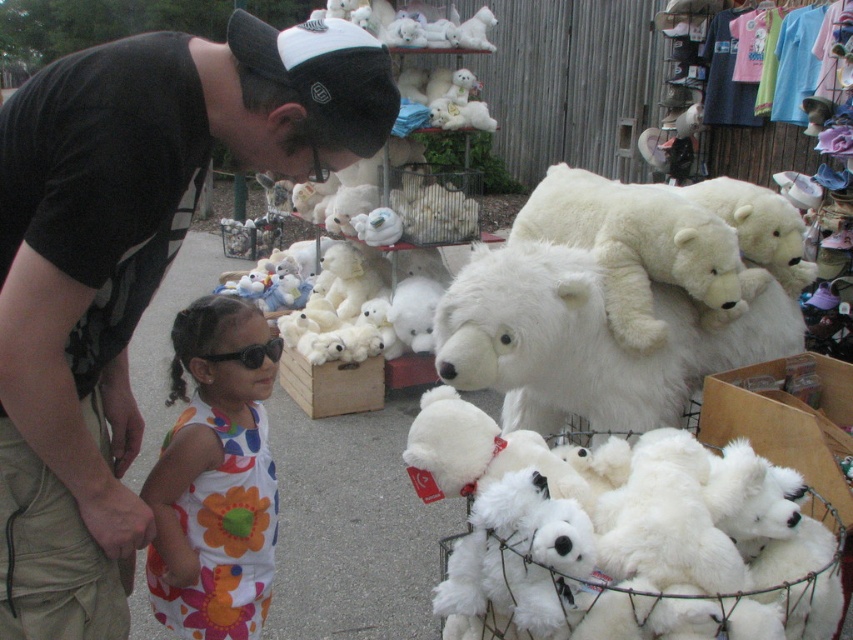
Is the position of black fabric cap at upper center more distant than that of black plastic goggles at center?

No, it is in front of black plastic goggles at center.

Between black fabric cap at upper center and black plastic goggles at center, which one is positioned lower?

black plastic goggles at center

Find the location of `black fabric cap at upper center`. black fabric cap at upper center is located at coordinates [131, 268].

Is fluffy white bear at center closer to camera compared to white plush bear at center?

Yes, it is in front of white plush bear at center.

The image size is (853, 640). I want to click on fluffy white bear at center, so click(587, 340).

In the scene shown: Is floral fabric dress at lower left below white plush bears at center?

No.

Find the location of a particular element. This screenshot has width=853, height=640. floral fabric dress at lower left is located at coordinates (215, 476).